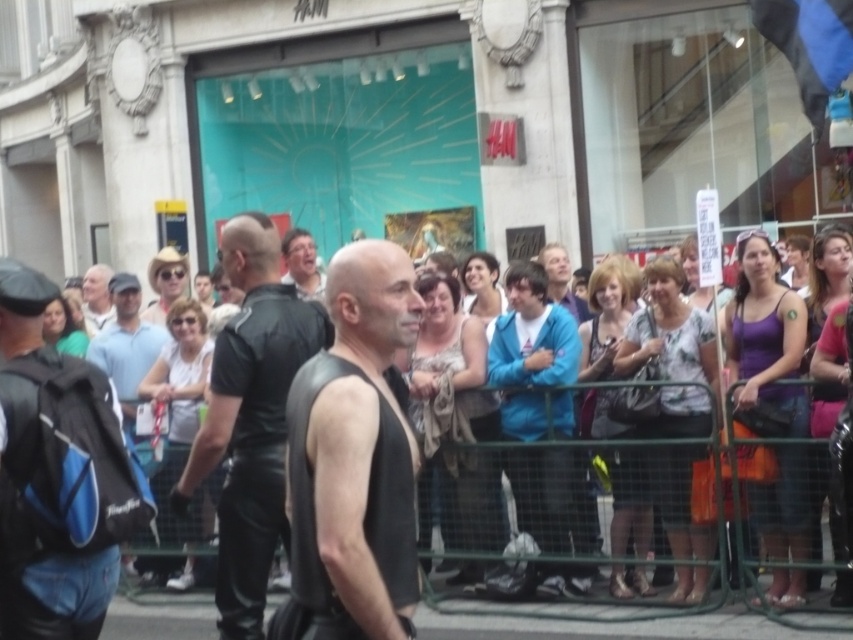
Question: Which point is closer to the camera taking this photo?

Choices:
 (A) (354, 634)
 (B) (239, 380)
 (C) (97, 269)
 (D) (439, 609)

Answer: (A)

Question: Does black leather vest at center come behind white matte shirt at upper left?

Choices:
 (A) yes
 (B) no

Answer: (B)

Question: Can you confirm if matte black shirt at center is positioned to the right of white matte shirt at upper left?

Choices:
 (A) yes
 (B) no

Answer: (A)

Question: Which object is positioned closest to the black leather jacket at center?

Choices:
 (A) black leather vest at center
 (B) matte black shirt at center
 (C) white matte shirt at upper left

Answer: (A)

Question: Is blue backpack at left closer to camera compared to blue leather jacket at center?

Choices:
 (A) no
 (B) yes

Answer: (B)

Question: Which object is closer to the camera taking this photo?

Choices:
 (A) matte black leather jacket at center
 (B) blue backpack at left
 (C) matte black shirt at center

Answer: (B)